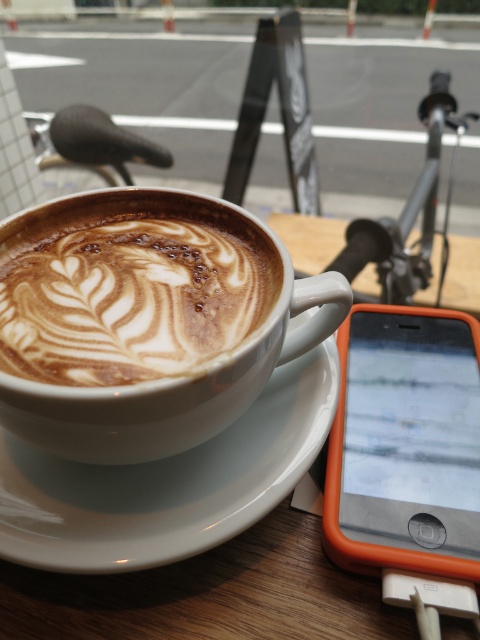
You are a barista who needs to place a new cup of coffee onto the table without spilling. The cup has a diameter of 5 inches. Can you safely place it between the cappuccino foam at center and the white ceramic saucer at center?

The distance between the cappuccino foam at center and the white ceramic saucer at center is 4.97 inches, which is slightly less than the cup diameter of 5 inches. Therefore, placing the cup between them might result in it touching either object, risking a spill. It would be safer to choose a wider space.

You are a barista who needs to place a new cup of coffee on the table without covering the orange plastic smartphone at lower right. The new cup will be placed near the cappuccino foam at center. Will the new cup overlap with the smartphone?

The cappuccino foam at center might be wider than orange plastic smartphone at lower right, so placing the new cup near the cappuccino foam at center could potentially overlap with the smartphone if the cup is too large. However, since the exact dimensions aren

You are a barista who just prepared a latte on the white ceramic saucer at center. You need to place it on a shelf that is 30 centimeters away from where you are standing. Can you safely place the latte on the shelf without spilling it?

The white ceramic saucer at center is 35.42 centimeters from the camera. Since the shelf is only 30 centimeters away, the distance between the saucer and the shelf is insufficient. You need to move closer to the shelf to place the latte safely without spilling.